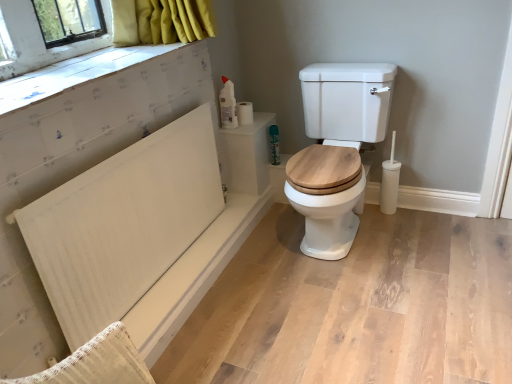
This screenshot has height=384, width=512. What are the coordinates of `free point to the right of white wood toilet at center` in the screenshot? It's located at (438, 238).